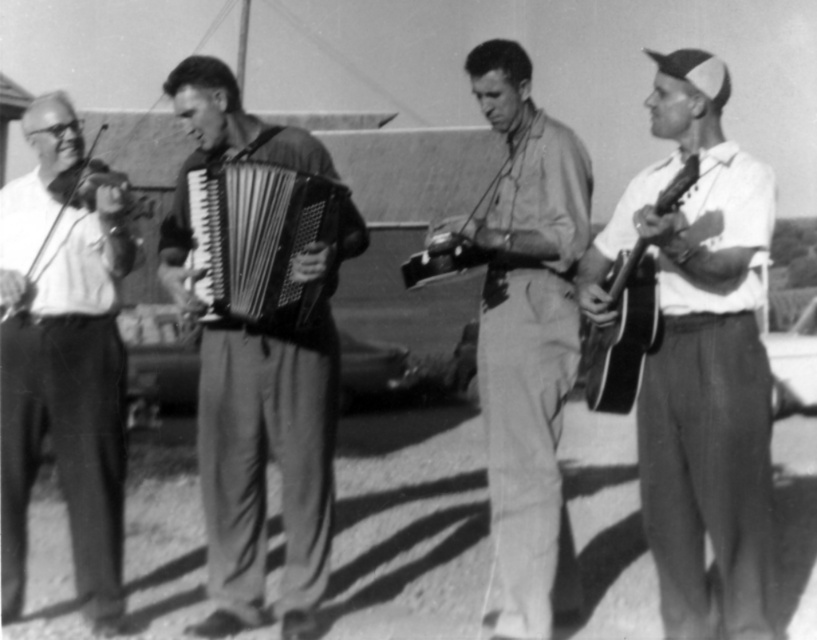
You are a photographer trying to capture the white matte guitar at right in your frame. The camera you are using has a focal length of 50mm. If the guitar is positioned at point 0.561 on the horizontal axis and 0.859 on the vertical axis, can you estimate whether it will be centered in the frame?

The white matte guitar at right is located at point 0.561 on the horizontal axis and 0.859 on the vertical axis. Since the center of the frame would be at coordinates approximately 0.5 on both axes, the guitar is slightly to the right and above the center. Therefore, it will not be perfectly centered but will be positioned near the upper right quadrant of the frame.

You are standing in front of the image and notice two points marked on it. The first point is at coordinates point (542, 120) and the second is at point (610, 372). Which of these points is closer to you?

Point (542, 120) is closer to you because it is further to the viewer than point (610, 372).